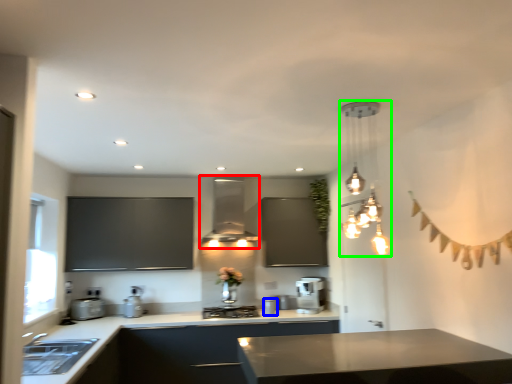
Question: Based on their relative distances, which object is nearer to exhaust hood (highlighted by a red box)? Choose from appliance (highlighted by a blue box) and lamp (highlighted by a green box).

Choices:
 (A) appliance
 (B) lamp

Answer: (A)